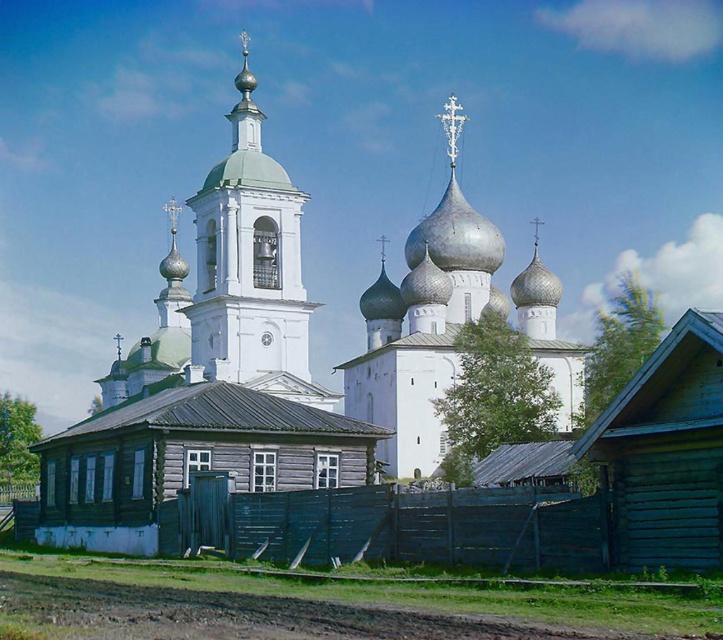
Based on the photo, you are a tourist visiting the church complex and want to take a photo that includes both the white stone church at center and the white stone bell tower at center. Since you want the church to appear more prominent in the photo, which object should you position closer to the camera?

The white stone church at center is larger than the white stone bell tower at center, so to make the church appear more prominent, you should position yourself closer to the church to emphasize its larger size in the photo.

You are standing in front of the church complex and want to walk to the point closer to the viewer between the two points, point [526,528] and point [429,220]. Which point should you head towards?

You should head towards point [526,528] because it is closer to the viewer than point [429,220].

You are a visitor standing at the entrance of the church complex. You notice the blue wooden fence at lower center and the white stone bell tower at center. Which structure has a greater width from your perspective?

The blue wooden fence at lower center has a greater width than the white stone bell tower at center from the visitor perspective.